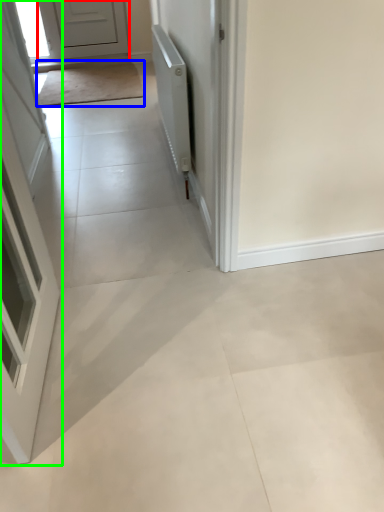
Question: Which object is positioned farthest from door (highlighted by a red box)? Select from mat (highlighted by a blue box) and door (highlighted by a green box).

Choices:
 (A) mat
 (B) door

Answer: (B)